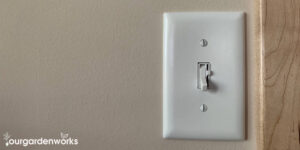
You are a GUI agent. You are given a task and a screenshot of the screen. Output one action in this format:
    pyautogui.click(x=<x>, y=<y>)
    Task: Click on the lower left corner of switchplate
    
    Given the screenshot: What is the action you would take?
    pyautogui.click(x=165, y=136)